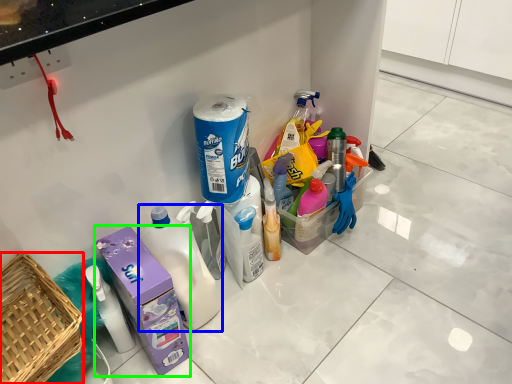
Question: Considering the real-world distances, which object is farthest from basket (highlighted by a red box)? bottle (highlighted by a blue box) or carton (highlighted by a green box)?

Choices:
 (A) bottle
 (B) carton

Answer: (A)